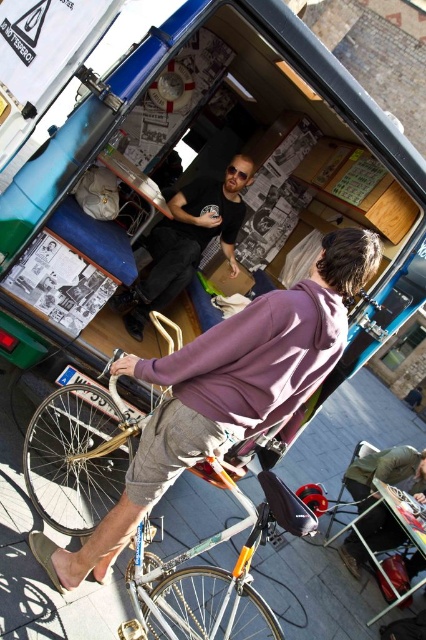
You are standing in the street scene and want to determine which of the two points, point [256,608] or point [152,268], is nearer to you. Based on the image, which point is closer?

Point [256,608] is closer to the viewer than point [152,268].